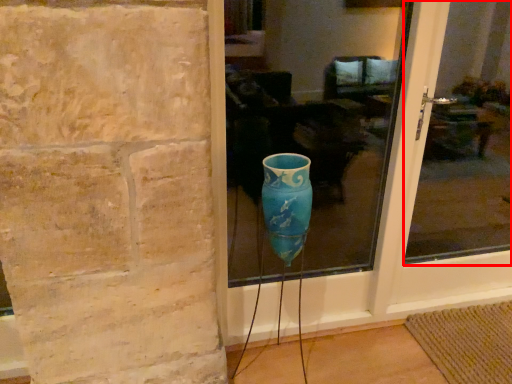
Question: From the image, what is the correct spatial relationship of glass window (annotated by the red box) in relation to glass window?

Choices:
 (A) right
 (B) left

Answer: (A)